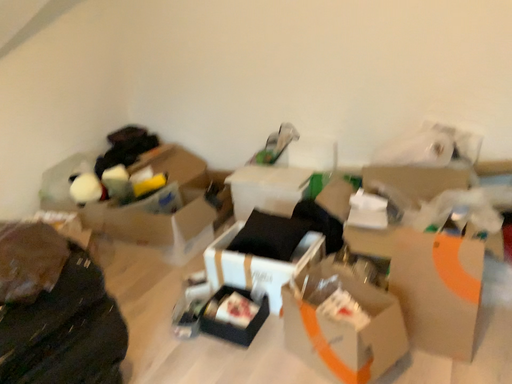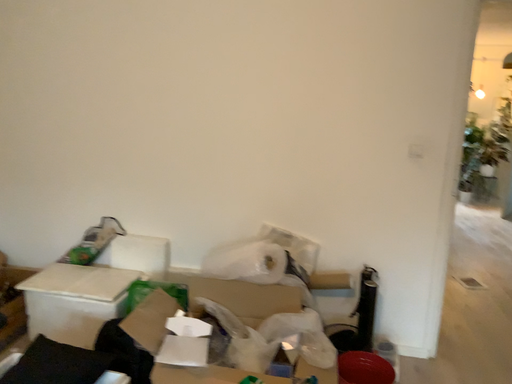
Question: Which way did the camera rotate in the video?

Choices:
 (A) rotated right
 (B) rotated left

Answer: (A)